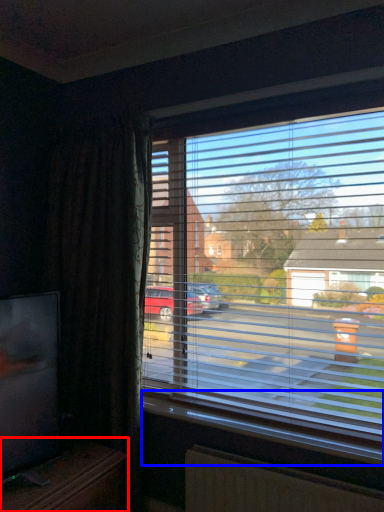
Question: Which of the following is the farthest to the observer, entertainment center (highlighted by a red box) or window sill (highlighted by a blue box)?

Choices:
 (A) entertainment center
 (B) window sill

Answer: (B)